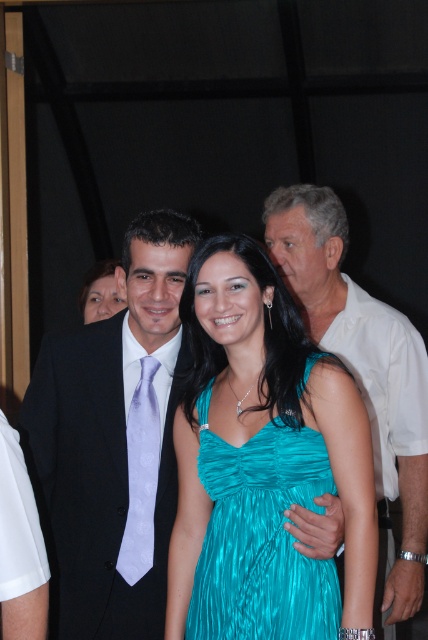
How far apart are teal satin dress at center and teal shiny dress at center?

teal satin dress at center and teal shiny dress at center are 23.09 inches apart.

Is teal satin dress at center above teal shiny dress at center?

Yes, teal satin dress at center is above teal shiny dress at center.

Is point (315, 326) more distant than point (241, 625)?

Yes.

At what (x,y) coordinates should I click in order to perform the action: click on teal satin dress at center. Please return your answer as a coordinate pair (x, y). This screenshot has width=428, height=640. Looking at the image, I should click on (357, 339).

Is black satin suit at center behind teal shiny dress at center?

Yes, black satin suit at center is further from the viewer.

Measure the distance between point (172, 225) and camera.

They are 1.84 meters apart.

Locate an element on the screen. This screenshot has width=428, height=640. black satin suit at center is located at coordinates (109, 444).

Does point (363, 352) come farther from viewer compared to point (142, 490)?

Yes, point (363, 352) is farther from viewer.

Does white smooth shirt at upper right have a greater height compared to lavender satin tie at center?

Yes.

Between point (397, 476) and point (136, 528), which one is positioned in front?

Point (136, 528)

This screenshot has width=428, height=640. Find the location of `white smooth shirt at upper right`. white smooth shirt at upper right is located at coordinates (362, 371).